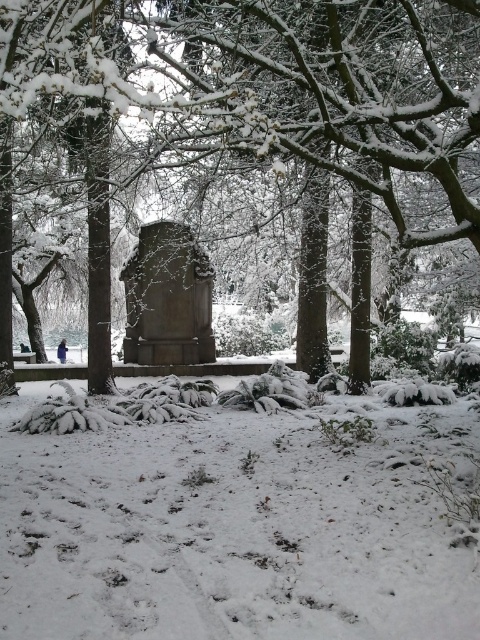
You are a winter explorer trying to walk across the snow in the park. You see the white fluffy snow at center and the granite tombstone at center. Which surface is more likely to support your weight without sinking?

The granite tombstone at center is more likely to support your weight without sinking because the white fluffy snow at center is thinner and less compacted than the tombstone.